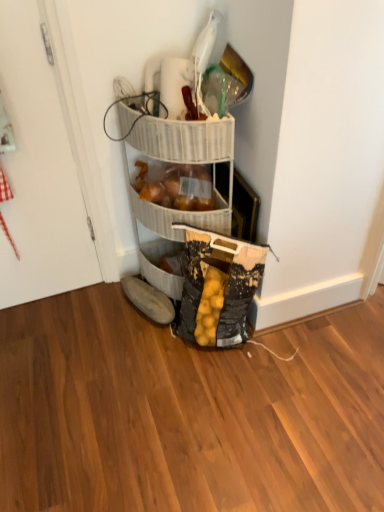
This screenshot has width=384, height=512. Identify the location of vacant space in front of brown suede shoe at lower center. (141, 347).